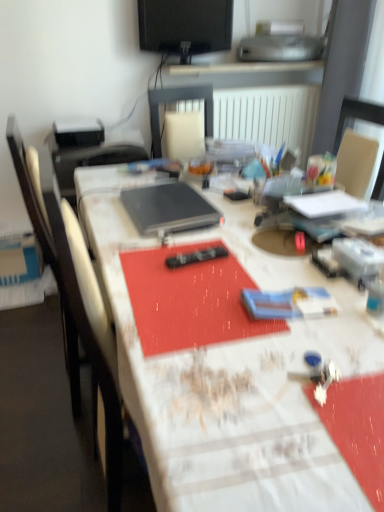
Where is `free point behind black plastic remote control at center`? The width and height of the screenshot is (384, 512). free point behind black plastic remote control at center is located at coordinates (205, 237).